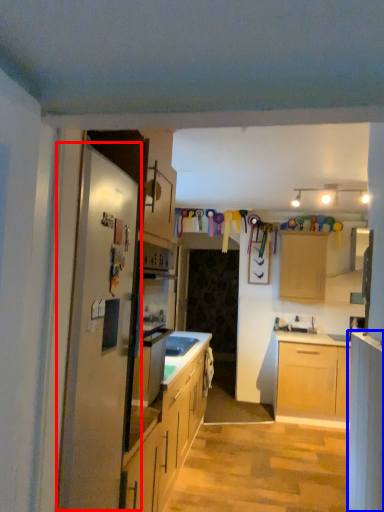
Question: Which of the following is the closest to the observer, fridge (highlighted by a red box) or cabinetry (highlighted by a blue box)?

Choices:
 (A) fridge
 (B) cabinetry

Answer: (A)